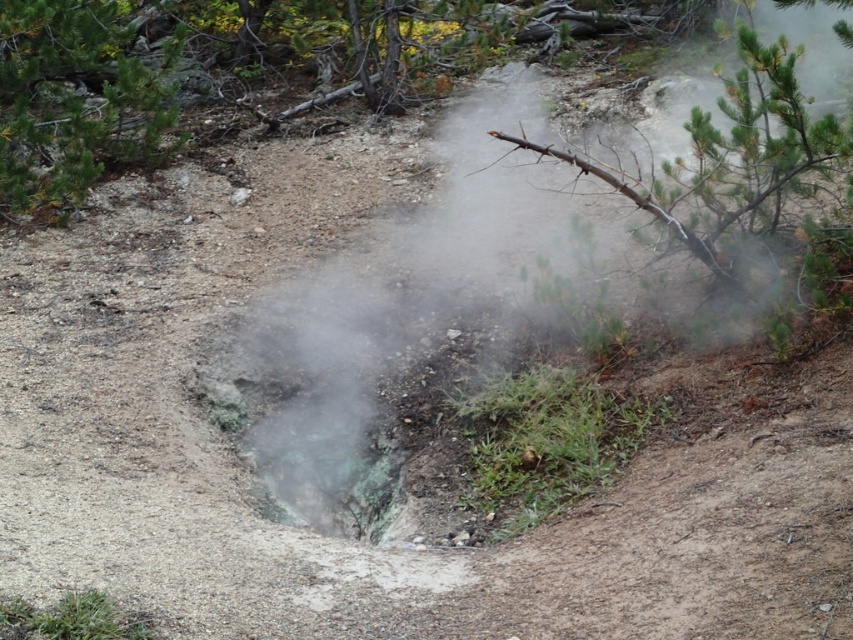
You are standing at the center of the geothermal area and want to locate the green pine tree at upper left. Based on the coordinates provided, in which cardinal direction should you look to find it?

The green pine tree at upper left is located at coordinates point (x=76, y=100), which corresponds to the upper left direction from your current position at the center of the geothermal area.

You are a hiker who wants to take a photo of both the green pine tree at upper left and the green leafy branch at upper right. Which object should you focus on first if you want to capture both in the same frame without moving the camera?

You should focus on the green pine tree at upper left first because it is taller than the green leafy branch at upper right, so adjusting the camera to include its height will naturally include the shorter branch in the frame.